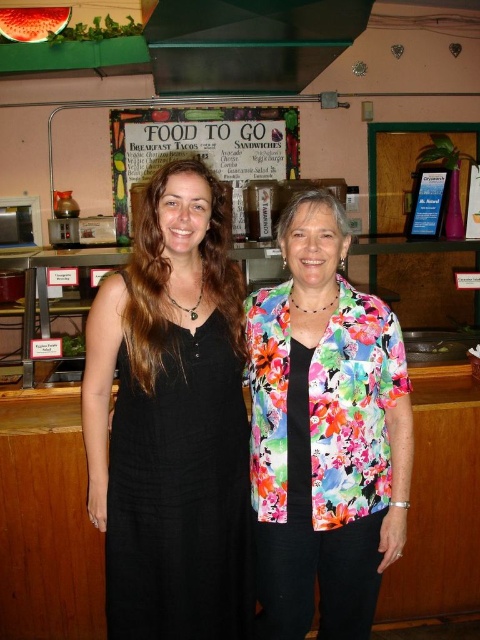
Question: Is black cotton dress at center closer to camera compared to floral fabric blouse at center?

Choices:
 (A) yes
 (B) no

Answer: (A)

Question: Does floral fabric blouse at center appear under white paperboard at upper center?

Choices:
 (A) yes
 (B) no

Answer: (A)

Question: Which is farther from the white paperboard at upper center?

Choices:
 (A) black cotton dress at center
 (B) floral fabric blouse at center

Answer: (B)

Question: Is floral fabric blouse at center to the right of white paperboard at upper center from the viewer's perspective?

Choices:
 (A) yes
 (B) no

Answer: (A)

Question: Based on their relative distances, which object is farther from the white paperboard at upper center?

Choices:
 (A) floral fabric blouse at center
 (B) black cotton dress at center

Answer: (A)

Question: Which point is farther to the camera?

Choices:
 (A) floral fabric blouse at center
 (B) black cotton dress at center

Answer: (A)